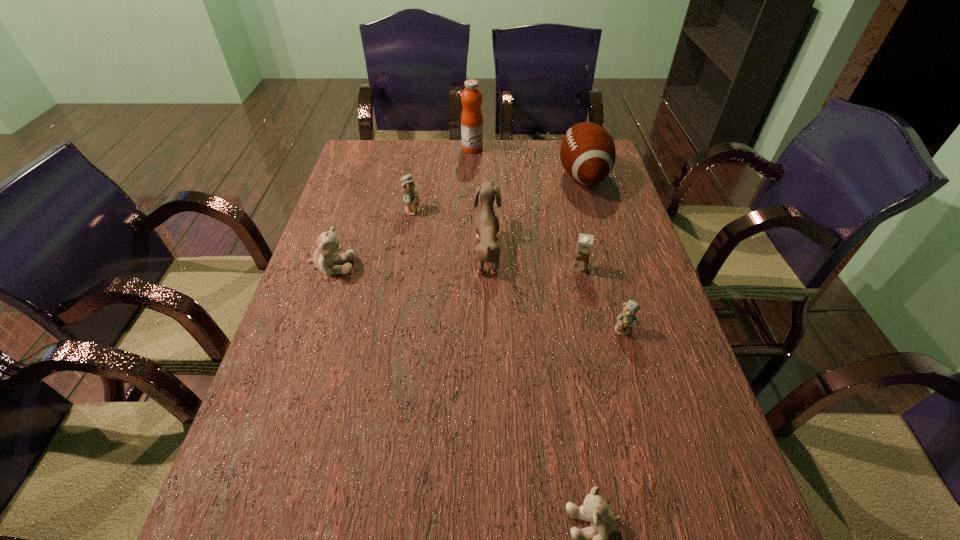
Identify the location of the nearer blue teddy bear. (627, 319).

I want to click on free space located 0.390m on the front label of the tallest object, so click(x=590, y=148).

I want to click on free region located 0.070m on the laces of the football, so click(x=537, y=176).

You are a GUI agent. You are given a task and a screenshot of the screen. Output one action in this format:
    pyautogui.click(x=<x>, y=<y>)
    Task: Click on the blank space located 0.150m on the laces of the football
    The width and height of the screenshot is (960, 540).
    Given the screenshot: What is the action you would take?
    pyautogui.click(x=513, y=176)

In order to click on free space located on the laces of the football in this screenshot , I will do 480,176.

This screenshot has width=960, height=540. I want to click on vacant space located 0.190m at the face of the puppy, so (x=405, y=250).

Identify the location of vacant region located 0.170m at the face of the puppy. The width and height of the screenshot is (960, 540). pyautogui.click(x=413, y=250).

Identify the location of vacant space situated 0.320m at the face of the puppy. The image size is (960, 540). (358, 250).

Locate an element on the screen. The width and height of the screenshot is (960, 540). free space located on the front-facing side of the bigger blue teddy bear is located at coordinates (444, 210).

Image resolution: width=960 pixels, height=540 pixels. I want to click on blank area located 0.240m on the face of the leftmost object, so click(445, 267).